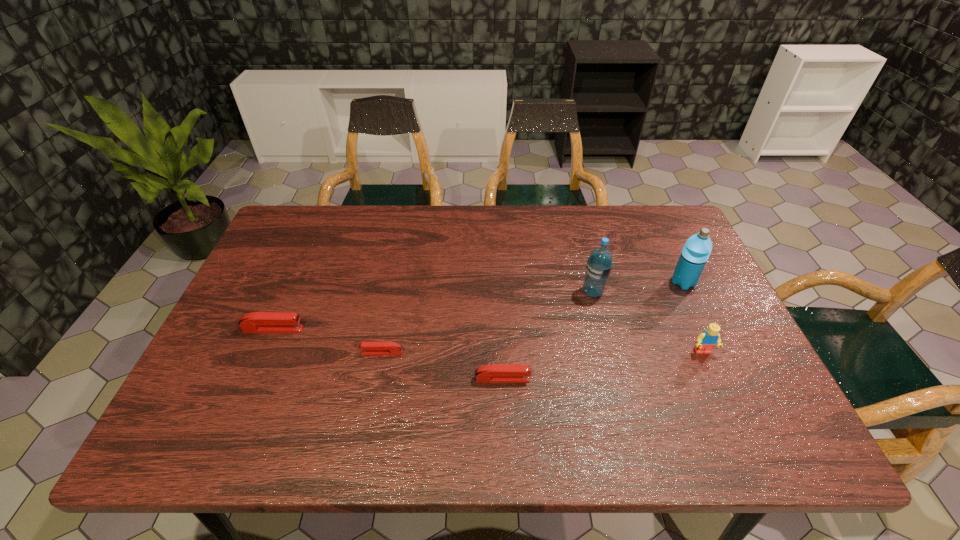
Identify the location of free space that is in between the water bottle and the fourth shortest object. 648,322.

Where is `vacant area between the third object from right to left and the thermos bottle`? The width and height of the screenshot is (960, 540). vacant area between the third object from right to left and the thermos bottle is located at coordinates (637, 287).

I want to click on free space between the shortest stapler and the thermos bottle, so click(x=533, y=318).

Identify the location of empty location between the Lego and the rightmost stapler. The height and width of the screenshot is (540, 960). (603, 365).

This screenshot has height=540, width=960. In order to click on vacant space in between the second nearest stapler and the thermos bottle in this screenshot , I will do `click(533, 318)`.

Image resolution: width=960 pixels, height=540 pixels. I want to click on vacant area that lies between the fifth object from right to left and the second shortest object, so click(443, 366).

You are a GUI agent. You are given a task and a screenshot of the screen. Output one action in this format:
    pyautogui.click(x=<x>, y=<y>)
    Task: Click on the unoccupied position between the second stapler from right to left and the rightmost stapler
    The width and height of the screenshot is (960, 540).
    Given the screenshot: What is the action you would take?
    tap(443, 366)

This screenshot has height=540, width=960. Find the location of `the second closest object to the fourth object from right to left`. the second closest object to the fourth object from right to left is located at coordinates (599, 264).

This screenshot has height=540, width=960. Identify the location of the fifth closest object relative to the fourth object from left to right. (256, 322).

The height and width of the screenshot is (540, 960). What are the coordinates of `stapler that is the closest one to the second shortest stapler` in the screenshot? It's located at (375, 348).